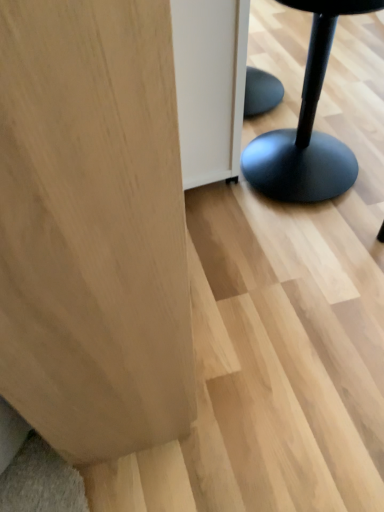
Where is `black matte stool at right`? black matte stool at right is located at coordinates (307, 125).

What do you see at coordinates (307, 125) in the screenshot? I see `black matte stool at right` at bounding box center [307, 125].

This screenshot has height=512, width=384. Describe the element at coordinates (92, 227) in the screenshot. I see `natural wood plywood at lower left` at that location.

Where is `natural wood plywood at lower left`? The width and height of the screenshot is (384, 512). natural wood plywood at lower left is located at coordinates (92, 227).

Where is `black matte stool at right`? black matte stool at right is located at coordinates (307, 125).

Considering the relative positions of natural wood plywood at lower left and black matte stool at right in the image provided, is natural wood plywood at lower left to the left of black matte stool at right from the viewer's perspective?

Indeed, natural wood plywood at lower left is positioned on the left side of black matte stool at right.

Who is more distant, natural wood plywood at lower left or black matte stool at right?

black matte stool at right is more distant.

Is point (179, 421) farther from camera compared to point (319, 194)?

No, it is not.

From the image's perspective, is natural wood plywood at lower left above or below black matte stool at right?

natural wood plywood at lower left is below black matte stool at right.

From a real-world perspective, which object rests below the other?

black matte stool at right is physically lower.

Which of these two, natural wood plywood at lower left or black matte stool at right, is wider?

natural wood plywood at lower left is wider.

Looking at this image, does natural wood plywood at lower left have a lesser height compared to black matte stool at right?

In fact, natural wood plywood at lower left may be taller than black matte stool at right.

Is natural wood plywood at lower left smaller than black matte stool at right?

Incorrect, natural wood plywood at lower left is not smaller in size than black matte stool at right.

Is black matte stool at right located within natural wood plywood at lower left?

No, black matte stool at right is located outside of natural wood plywood at lower left.

Would you say natural wood plywood at lower left is a long distance from black matte stool at right?

No.

Is natural wood plywood at lower left aimed at black matte stool at right?

No, natural wood plywood at lower left is not turned towards black matte stool at right.

How different are the orientations of natural wood plywood at lower left and black matte stool at right in degrees?

87 degrees.

Find the location of `furniture behind the natural wood plywood at lower left`. furniture behind the natural wood plywood at lower left is located at coordinates (307, 125).

Does black matte stool at right appear on the left side of natural wood plywood at lower left?

Incorrect, black matte stool at right is not on the left side of natural wood plywood at lower left.

Does black matte stool at right lie in front of natural wood plywood at lower left?

No.

Is point (263, 165) closer to viewer compared to point (155, 11)?

No, (263, 165) is behind (155, 11).

From the image's perspective, does black matte stool at right appear lower than natural wood plywood at lower left?

Incorrect, from the image's perspective, black matte stool at right is higher than natural wood plywood at lower left.

In the scene shown: From a real-world perspective, does black matte stool at right stand above natural wood plywood at lower left?

No, from a real-world perspective, black matte stool at right is not over natural wood plywood at lower left

Is black matte stool at right thinner than natural wood plywood at lower left?

Yes, black matte stool at right is thinner than natural wood plywood at lower left.

Does black matte stool at right have a lesser height compared to natural wood plywood at lower left?

Indeed, black matte stool at right has a lesser height compared to natural wood plywood at lower left.

In terms of size, does black matte stool at right appear bigger or smaller than natural wood plywood at lower left?

black matte stool at right is smaller than natural wood plywood at lower left.

Would you say black matte stool at right is outside natural wood plywood at lower left?

Yes, black matte stool at right is not within natural wood plywood at lower left.

Looking at this image, would you say black matte stool at right is a long distance from natural wood plywood at lower left?

No, black matte stool at right is not far from natural wood plywood at lower left.

Is black matte stool at right facing away from natural wood plywood at lower left?

No, black matte stool at right is not facing the opposite direction of natural wood plywood at lower left.

The width and height of the screenshot is (384, 512). What are the coordinates of `furniture located on the right of natural wood plywood at lower left` in the screenshot? It's located at [307, 125].

Locate an element on the screen. This screenshot has height=512, width=384. furniture above the natural wood plywood at lower left (from the image's perspective) is located at coordinates (307, 125).

The image size is (384, 512). I want to click on plywood on the left of black matte stool at right, so (92, 227).